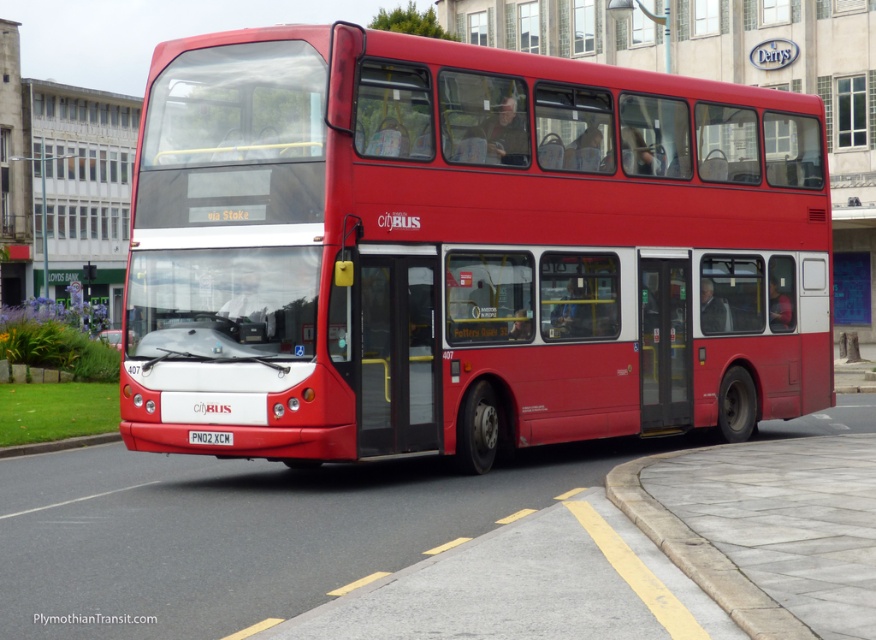
Can you confirm if matte red bus at center is bigger than red plastic license plate at center?

Correct, matte red bus at center is larger in size than red plastic license plate at center.

Which is more to the left, matte red bus at center or red plastic license plate at center?

red plastic license plate at center

I want to click on matte red bus at center, so click(x=463, y=250).

This screenshot has width=876, height=640. What are the coordinates of `matte red bus at center` in the screenshot? It's located at (463, 250).